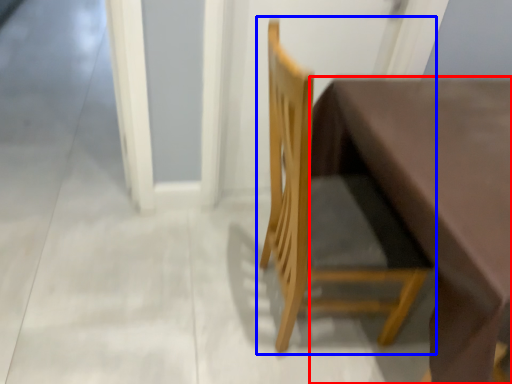
Question: Which object appears farthest to the camera in this image, table (highlighted by a red box) or chair (highlighted by a blue box)?

Choices:
 (A) table
 (B) chair

Answer: (B)